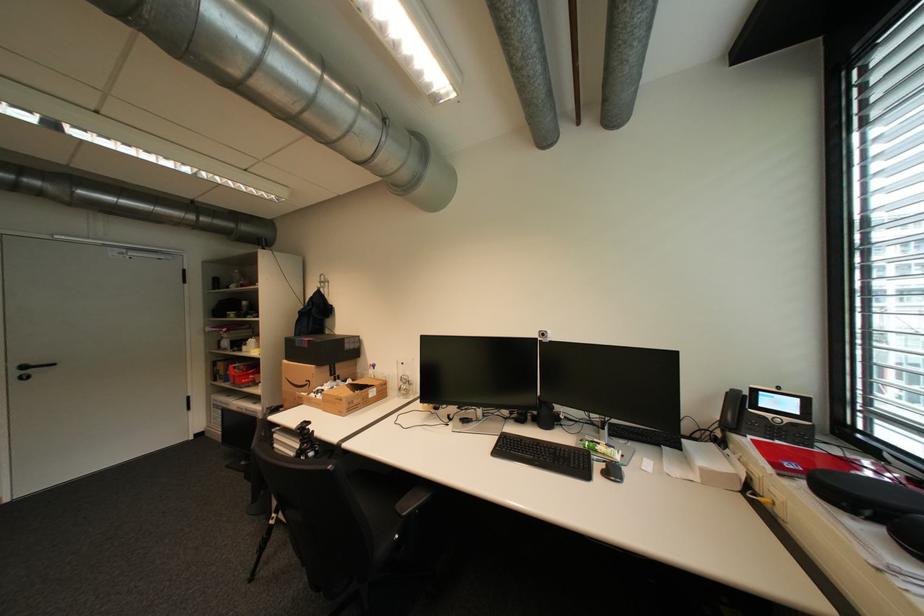
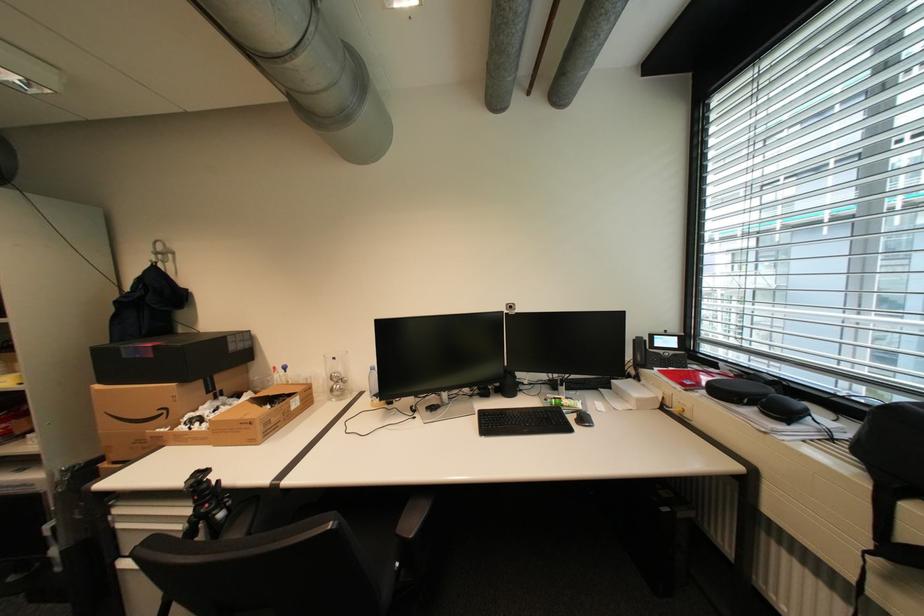
Locate, in the second image, the point that corresponds to point (313, 432) in the first image.

(213, 485)